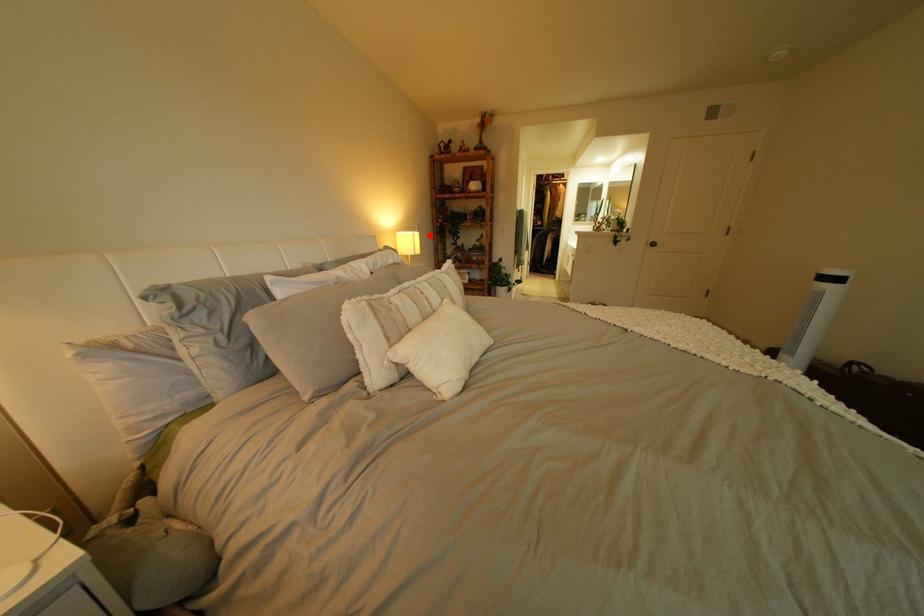
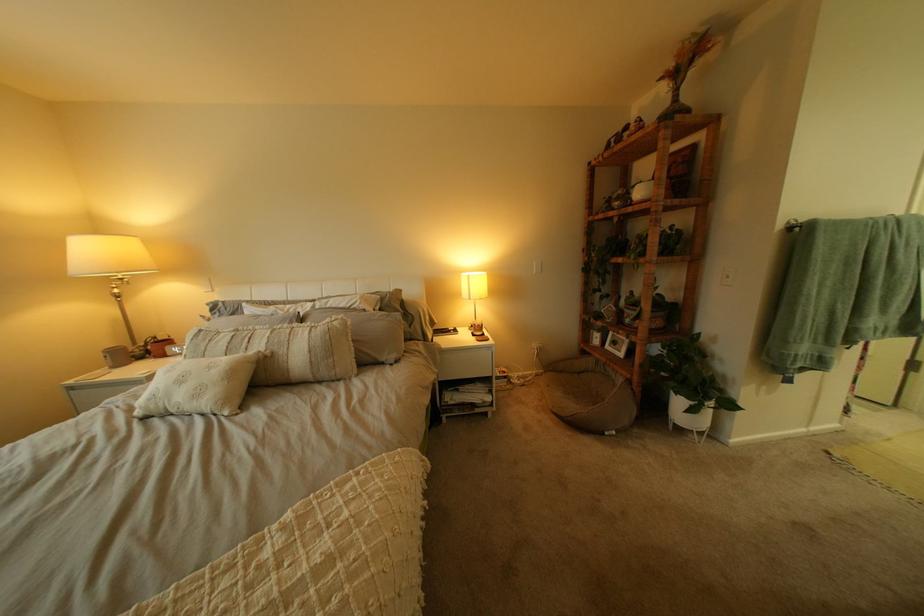
The point at the highlighted location is marked in the first image. Where is the corresponding point in the second image?

(483, 277)